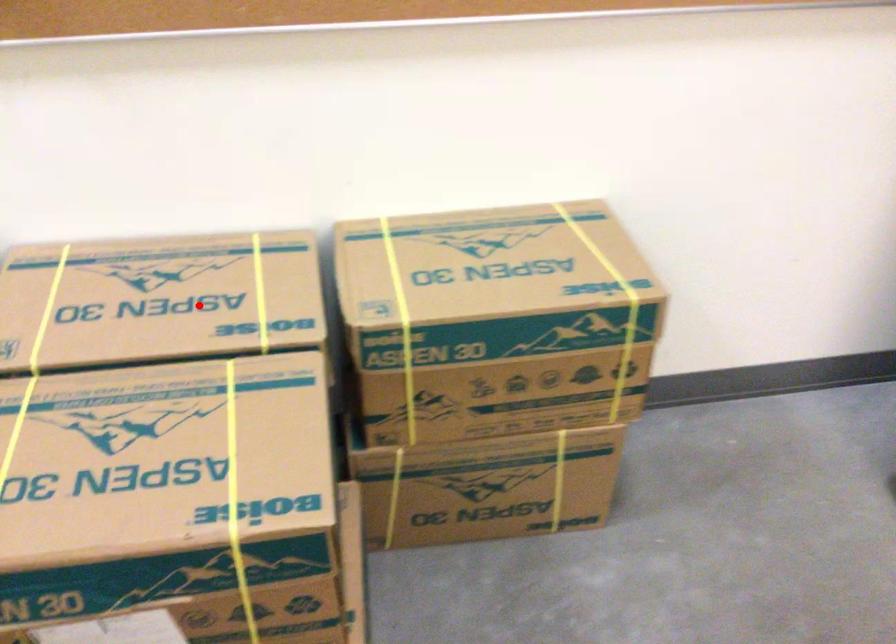
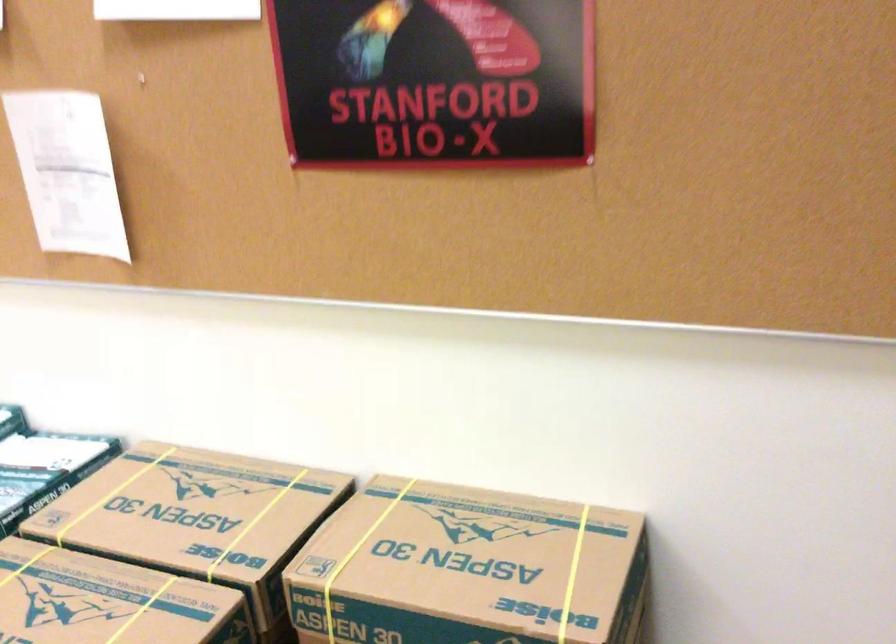
Question: I am providing you with two images of the same scene from different viewpoints. Given a red point in image1, look at the same physical point in image2. Is it:

Choices:
 (A) Closer to the viewpoint
 (B) Farther from the viewpoint

Answer: (B)